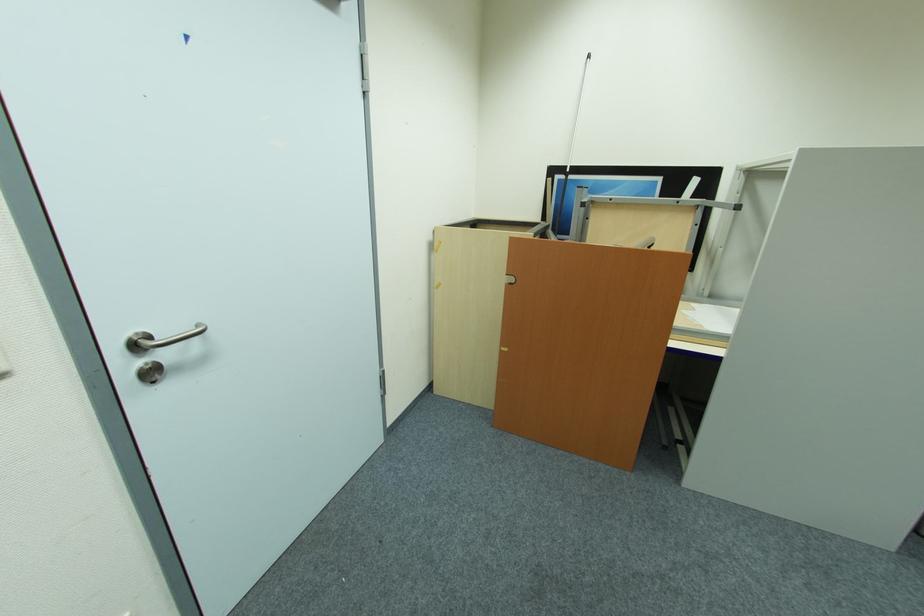
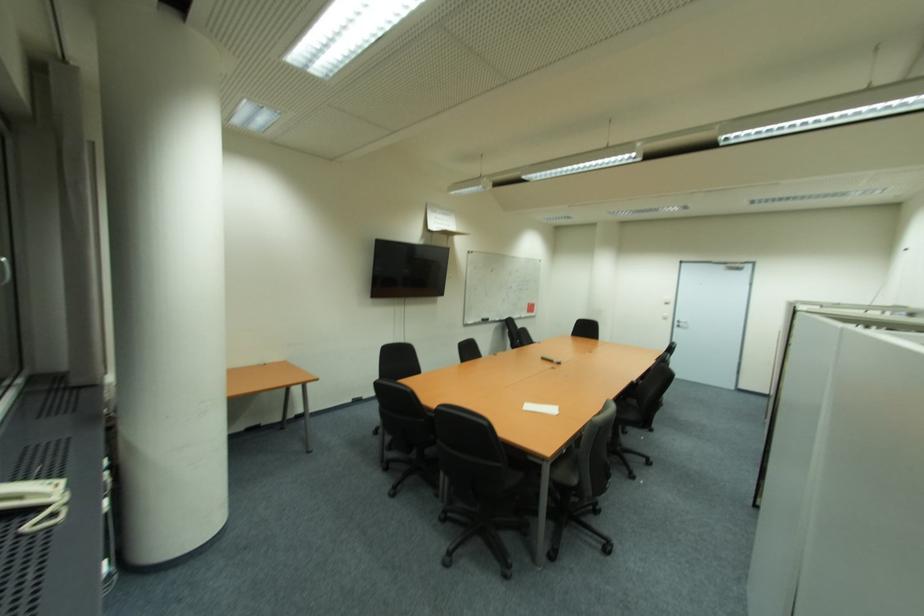
In the second image, find the point that corresponds to point 169,355 in the first image.

(686, 325)